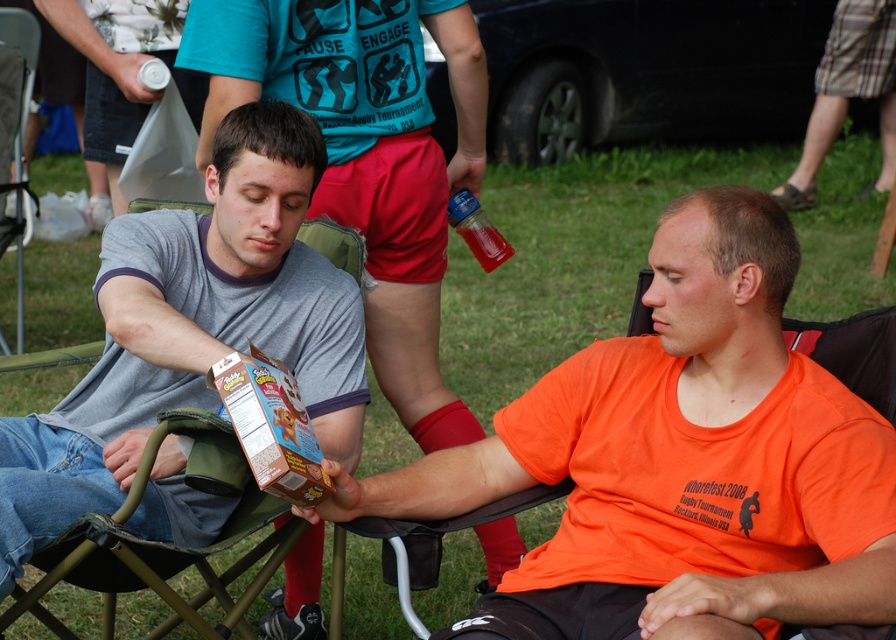
You are a photographer trying to capture a candid shot of both the gray cotton shirt at left and the matte gray shirt at center. Based on their positions, which one should you focus on first to ensure they are both in the frame?

The gray cotton shirt at left is below the matte gray shirt at center, so you should focus on the matte gray shirt at center first to ensure both are in the frame.

Based on the photo, you are a photographer trying to capture a clear photo of the translucent plastic bottle at upper center. However, the matte gray shirt at center is blocking your view. Can you move the bottle or the shirt to get an unobstructed shot?

The matte gray shirt at center is in front of the translucent plastic bottle at upper center, so you would need to move the matte gray shirt at center out of the way to get an unobstructed view of the bottle.